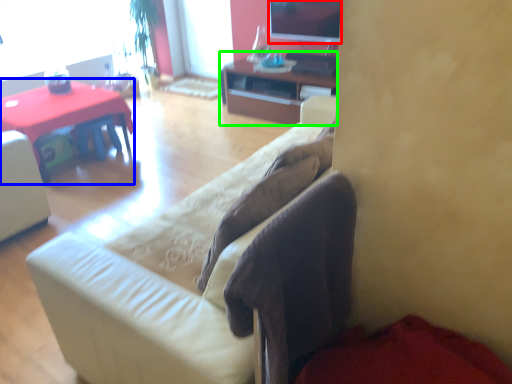
Question: Considering the real-world distances, which object is closest to television (highlighted by a red box)? desk (highlighted by a blue box) or cabinetry (highlighted by a green box).

Choices:
 (A) desk
 (B) cabinetry

Answer: (B)